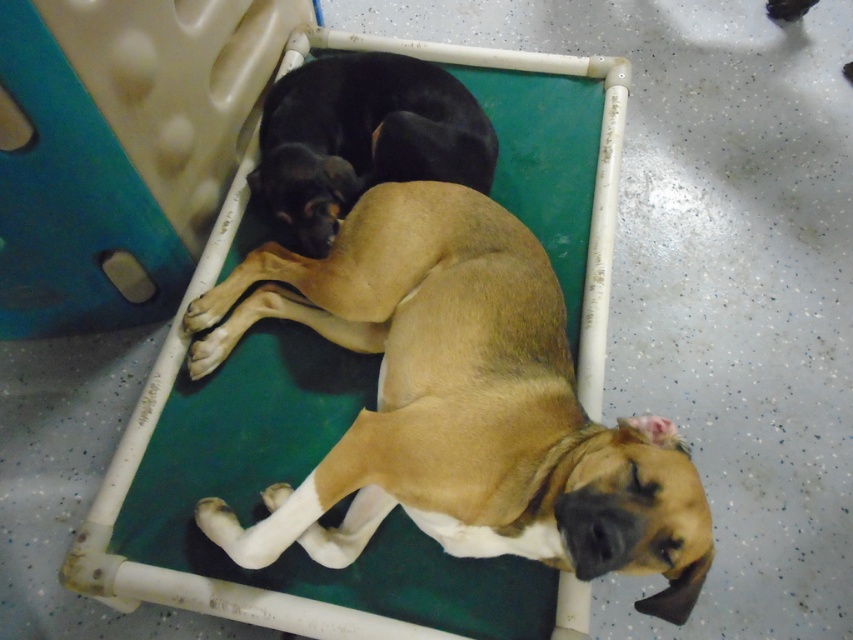
Describe the element at coordinates (457, 404) in the screenshot. This screenshot has height=640, width=853. I see `brown smooth dog at center` at that location.

Between brown smooth dog at center and black fur dog at center, which one is positioned lower?

brown smooth dog at center is lower down.

Between point (498, 259) and point (392, 145), which one is positioned behind?

The point (392, 145) is more distant.

This screenshot has width=853, height=640. Identify the location of brown smooth dog at center. (457, 404).